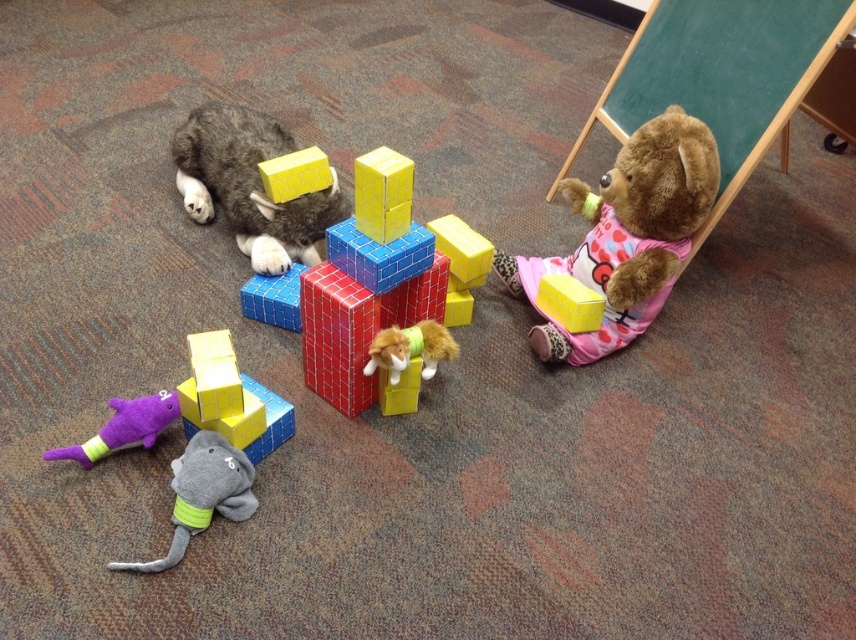
Question: Which object is farther from the camera taking this photo?

Choices:
 (A) fuzzy yellow toy at center
 (B) fuzzy gray cat at upper left

Answer: (B)

Question: Can you confirm if fuzzy gray cat at upper left is positioned above gray plush elephant at lower left?

Choices:
 (A) no
 (B) yes

Answer: (B)

Question: Can you confirm if fuzzy gray cat at upper left is positioned to the right of purple plush toy at lower left?

Choices:
 (A) yes
 (B) no

Answer: (A)

Question: Estimate the real-world distances between objects in this image. Which object is closer to the purple plush toy at lower left?

Choices:
 (A) gray plush elephant at lower left
 (B) matte yellow cube at center
 (C) fuzzy yellow toy at center
 (D) rubberized plastic blocks at center

Answer: (B)

Question: Which point is farther to the camera?

Choices:
 (A) (432, 348)
 (B) (637, 202)

Answer: (B)

Question: From the image, what is the correct spatial relationship of purple plush toy at lower left in relation to yellow matte block at center?

Choices:
 (A) left
 (B) right

Answer: (A)